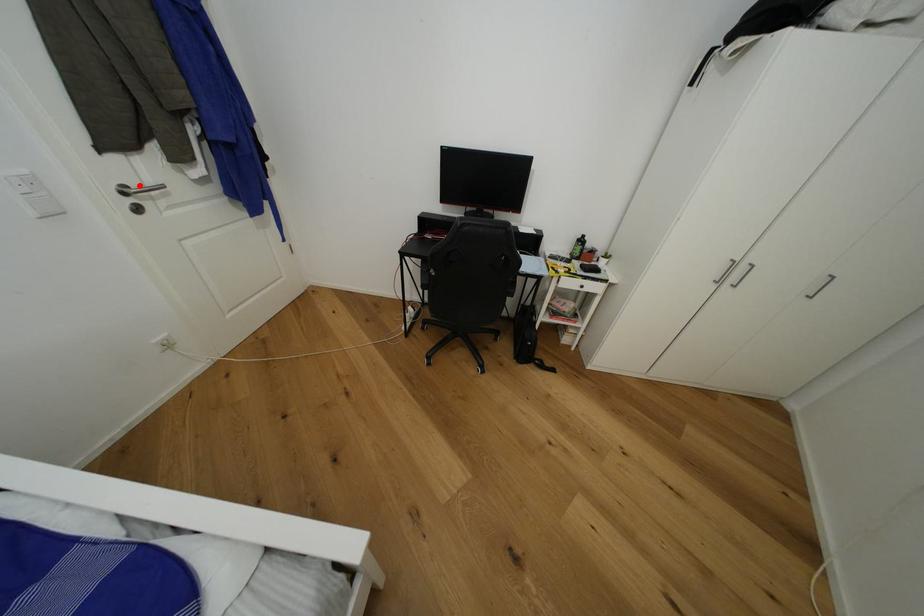
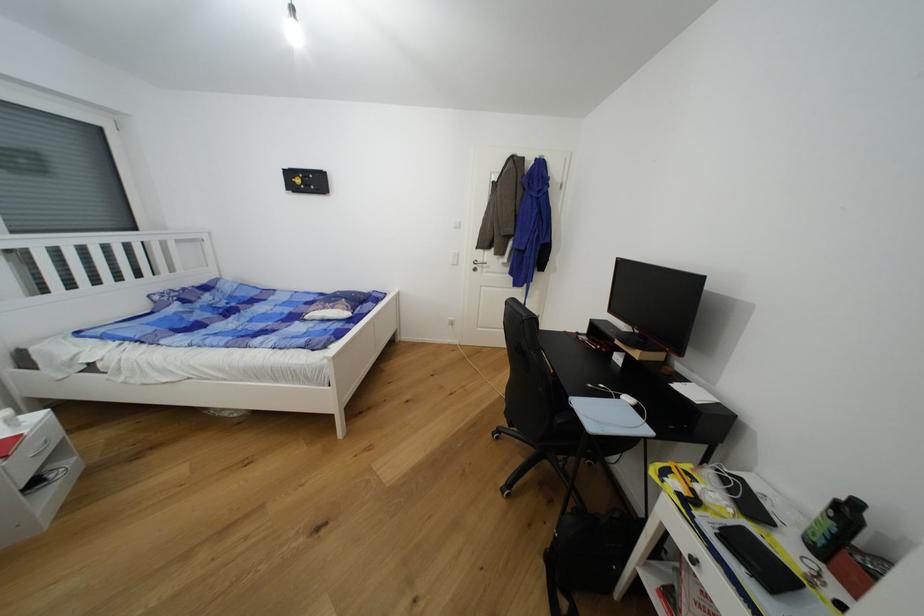
The point at the highlighted location is marked in the first image. Where is the corresponding point in the second image?

(484, 262)